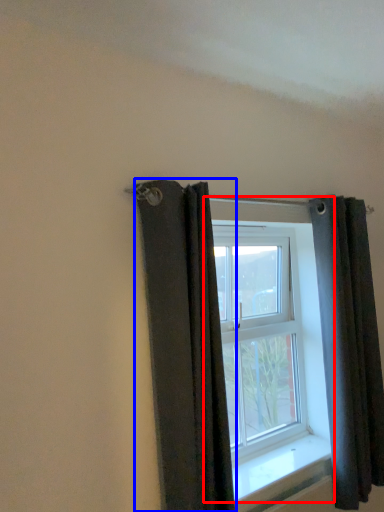
Question: Which of the following is the closest to the observer, window (highlighted by a red box) or curtain (highlighted by a blue box)?

Choices:
 (A) window
 (B) curtain

Answer: (B)